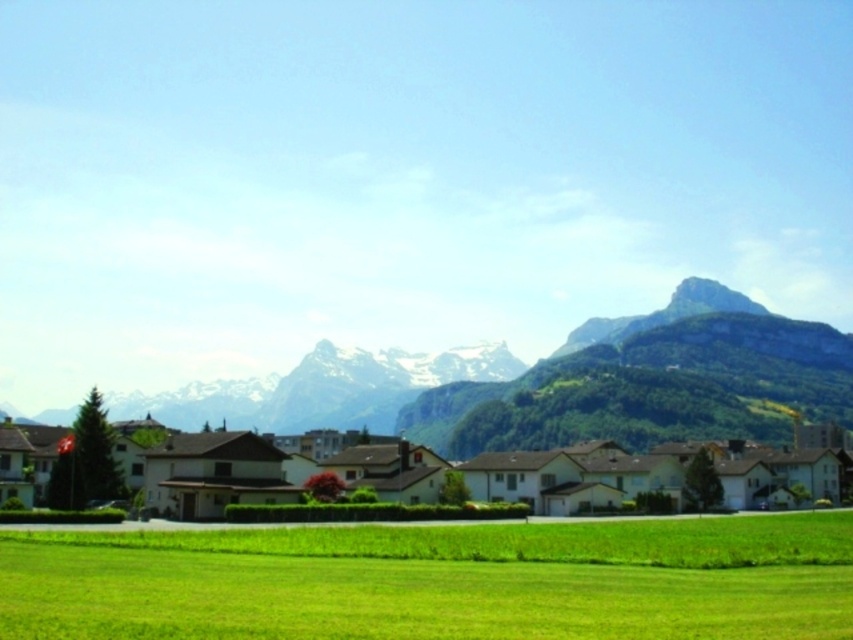
Question: Can you confirm if green grass at center is bigger than green grassy hillside at lower center?

Choices:
 (A) yes
 (B) no

Answer: (B)

Question: Which point is farther to the camera?

Choices:
 (A) (700, 525)
 (B) (840, 397)

Answer: (B)

Question: Can you confirm if green grass at center is wider than green grassy hillside at lower center?

Choices:
 (A) yes
 (B) no

Answer: (B)

Question: From the image, what is the correct spatial relationship of green grass at center in relation to green grassy hillside at lower center?

Choices:
 (A) right
 (B) left

Answer: (A)